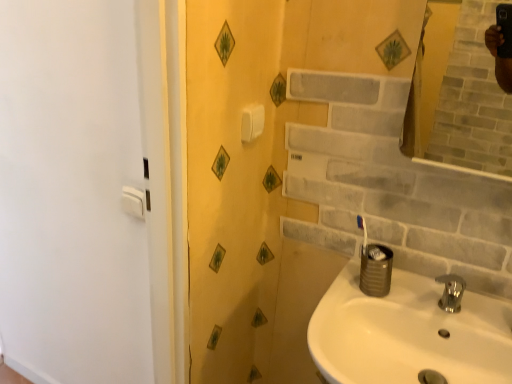
What are the coordinates of `spots to the right of polished chrome faucet at lower right` in the screenshot? It's located at (485, 319).